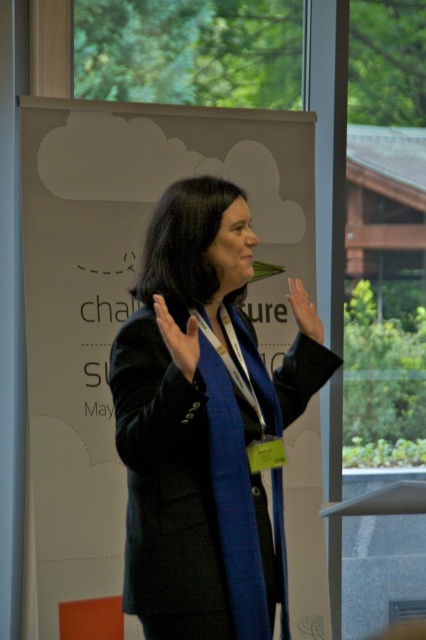
Consider the image. Which of these two, blue fabric hand at center or matte black hand at upper center, stands shorter?

matte black hand at upper center

From the picture: Does blue fabric hand at center have a larger size compared to matte black hand at upper center?

Yes.

This screenshot has height=640, width=426. What do you see at coordinates (178, 339) in the screenshot?
I see `blue fabric hand at center` at bounding box center [178, 339].

Identify the location of blue fabric hand at center. The width and height of the screenshot is (426, 640). (178, 339).

Is black woolen blazer at center smaller than matte black hand at upper center?

No.

Looking at this image, is black woolen blazer at center closer to camera compared to matte black hand at upper center?

Yes, it is in front of matte black hand at upper center.

Is point (252, 260) closer to camera compared to point (285, 296)?

Yes, it is.

Where is `black woolen blazer at center`? This screenshot has height=640, width=426. black woolen blazer at center is located at coordinates (204, 429).

Is point (198, 417) closer to camera compared to point (187, 364)?

No.

Which of these two, black woolen blazer at center or blue fabric hand at center, stands shorter?

Standing shorter between the two is blue fabric hand at center.

At what (x,y) coordinates should I click in order to perform the action: click on black woolen blazer at center. Please return your answer as a coordinate pair (x, y). This screenshot has width=426, height=640. Looking at the image, I should click on (204, 429).